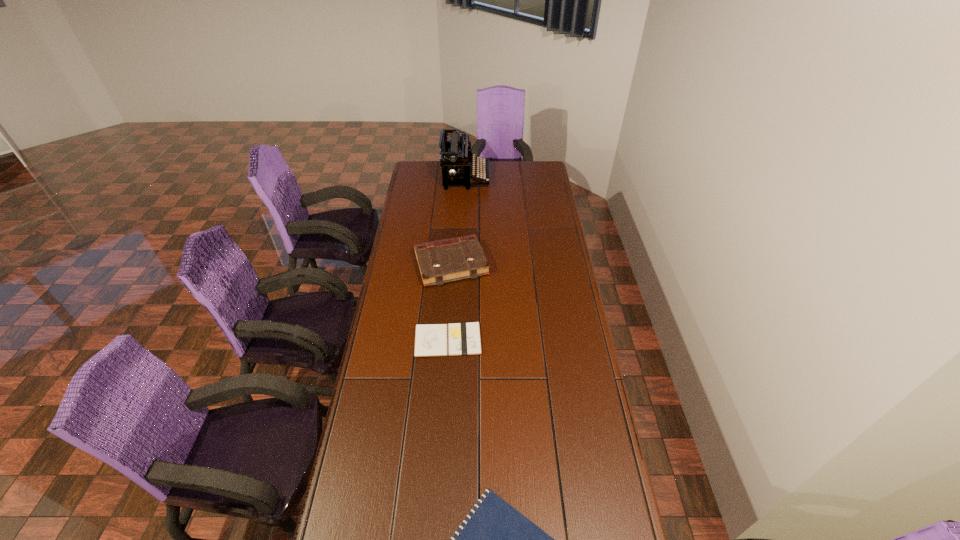
I want to click on the tallest object, so click(x=455, y=155).

Where is `typewriter`? typewriter is located at coordinates (455, 155).

Image resolution: width=960 pixels, height=540 pixels. I want to click on the second farthest object, so click(441, 261).

Locate an element on the screen. Image resolution: width=960 pixels, height=540 pixels. the third shortest object is located at coordinates (441, 261).

I want to click on the third farthest object, so click(x=431, y=340).

I want to click on free space located on the typing side of the tallest object, so click(547, 177).

You are a GUI agent. You are given a task and a screenshot of the screen. Output one action in this format:
    pyautogui.click(x=<x>, y=<y>)
    Task: Click on the vacant space situated 0.270m on the back of the hardback book
    This screenshot has width=960, height=540.
    Given the screenshot: What is the action you would take?
    pyautogui.click(x=455, y=208)

In order to click on vacant area located 0.120m on the right of the second nearest object in this screenshot , I will do `click(515, 340)`.

Find the location of a particular element. Image resolution: width=960 pixels, height=540 pixels. object that is at the far edge is located at coordinates [x=455, y=155].

Where is `hardback book at the left edge`? The image size is (960, 540). hardback book at the left edge is located at coordinates (441, 261).